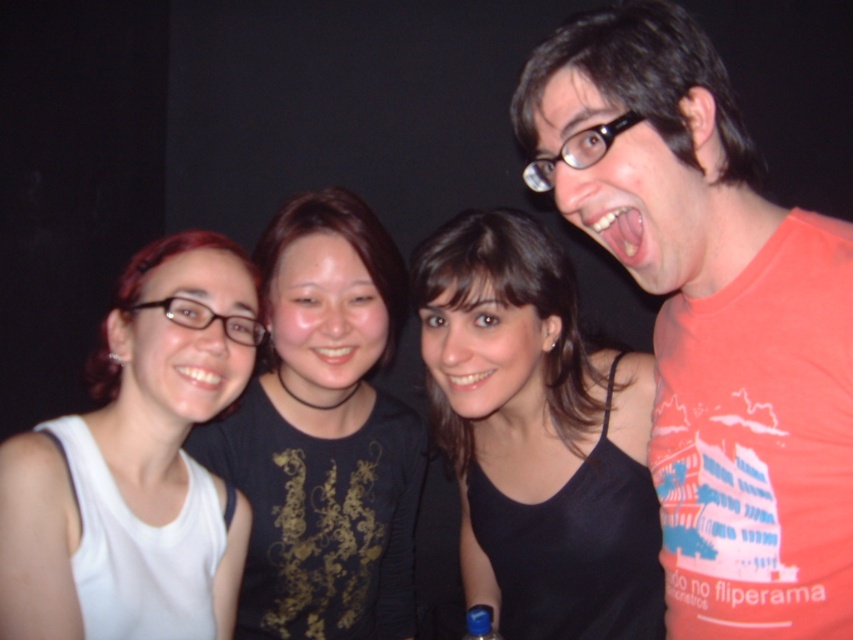
What is the color of the fabric located at the coordinates point (537, 436) in the image?

The point (537, 436) marks black fabric at center.